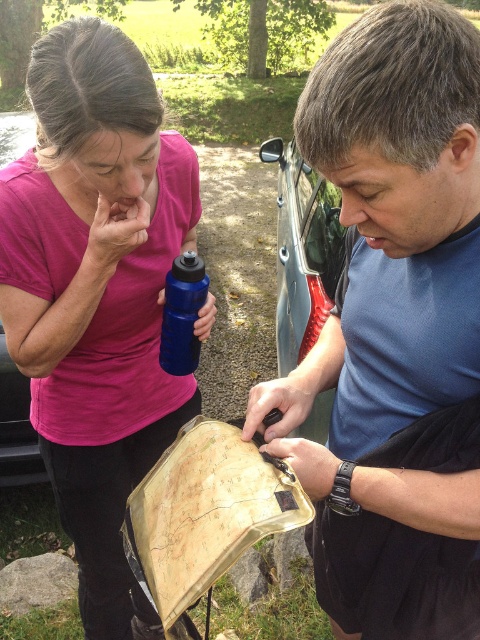
Question: Which of the following is the closest to the observer?

Choices:
 (A) (26, 419)
 (B) (295, 177)
 (C) (373, 195)

Answer: (C)

Question: Which point appears farthest from the camera in this image?

Choices:
 (A) (194, 253)
 (B) (22, 417)
 (C) (46, 108)

Answer: (B)

Question: Does matte pink shirt at upper left appear under metallic blue car at left?

Choices:
 (A) no
 (B) yes

Answer: (A)

Question: Is matte plastic map at center above blue matte water bottle at center?

Choices:
 (A) yes
 (B) no

Answer: (B)

Question: Can you confirm if matte pink shirt at upper left is positioned to the right of metallic silver car at center?

Choices:
 (A) yes
 (B) no

Answer: (B)

Question: Estimate the real-world distances between objects in this image. Which object is farther from the metallic silver car at center?

Choices:
 (A) metallic blue car at left
 (B) blue matte water bottle at center
 (C) matte pink shirt at upper left
 (D) matte plastic map at center

Answer: (D)